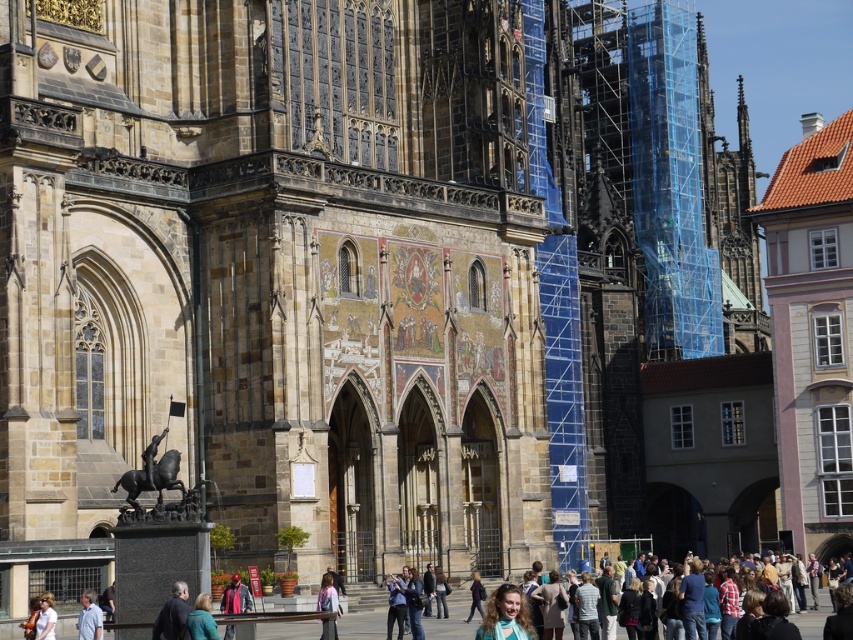
Image resolution: width=853 pixels, height=640 pixels. What are the coordinates of `pink fabric bag at lower center` in the screenshot? It's located at tap(328, 605).

Can you confirm if pink fabric bag at lower center is thinner than blue denim jacket at lower center?

No.

Is point (329, 625) more distant than point (194, 636)?

Yes.

Identify the location of pink fabric bag at lower center. The height and width of the screenshot is (640, 853). (328, 605).

Can you confirm if matte black jacket at lower center is positioned to the left of pink fabric bag at lower center?

Correct, you'll find matte black jacket at lower center to the left of pink fabric bag at lower center.

Which is behind, point (252, 608) or point (323, 588)?

The point (252, 608) is behind.

Is point (225, 612) positioned after point (326, 602)?

Yes, point (225, 612) is farther from viewer.

Find the location of a particular element. matte black jacket at lower center is located at coordinates (235, 596).

Looking at this image, can you confirm if matte black jacket at lower center is taller than light blue shirt at lower left?

Yes, matte black jacket at lower center is taller than light blue shirt at lower left.

In the scene shown: Is matte black jacket at lower center thinner than light blue shirt at lower left?

No, matte black jacket at lower center is not thinner than light blue shirt at lower left.

Is point (231, 627) less distant than point (80, 595)?

Yes, point (231, 627) is in front of point (80, 595).

The height and width of the screenshot is (640, 853). Find the location of `matte black jacket at lower center`. matte black jacket at lower center is located at coordinates (235, 596).